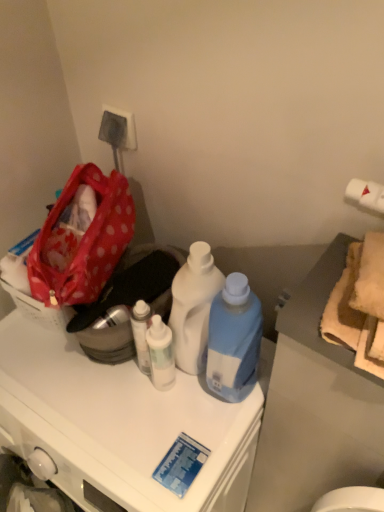
Question: From a real-world perspective, is red polka dot fabric bag at left located beneath white glossy bottle at center, acting as the 3th bottle starting from the right?

Choices:
 (A) no
 (B) yes

Answer: (A)

Question: Is red polka dot fabric bag at left at the left side of white glossy bottle at center, which ranks as the 1th bottle in left-to-right order?

Choices:
 (A) no
 (B) yes

Answer: (B)

Question: Could you tell me if red polka dot fabric bag at left is facing white glossy bottle at center, which ranks as the 1th bottle in left-to-right order?

Choices:
 (A) yes
 (B) no

Answer: (B)

Question: From the image's perspective, is red polka dot fabric bag at left below white glossy bottle at center, which ranks as the 1th bottle in left-to-right order?

Choices:
 (A) no
 (B) yes

Answer: (A)

Question: Is red polka dot fabric bag at left taller than white glossy bottle at center, acting as the 3th bottle starting from the right?

Choices:
 (A) yes
 (B) no

Answer: (A)

Question: Is red polka dot fabric bag at left not close to white glossy bottle at center, acting as the 3th bottle starting from the right?

Choices:
 (A) no
 (B) yes

Answer: (A)

Question: From a real-world perspective, is blue plastic bottle at center, the 1th bottle when ordered from right to left, over white glossy cabinet at center?

Choices:
 (A) yes
 (B) no

Answer: (A)

Question: From the image's perspective, is blue plastic bottle at center, which is counted as the third bottle, starting from the left, on white glossy cabinet at center?

Choices:
 (A) no
 (B) yes

Answer: (B)

Question: Is blue plastic bottle at center, the 1th bottle when ordered from right to left, thinner than white glossy cabinet at center?

Choices:
 (A) yes
 (B) no

Answer: (A)

Question: Is blue plastic bottle at center, which is counted as the third bottle, starting from the left, further to the viewer compared to white glossy cabinet at center?

Choices:
 (A) no
 (B) yes

Answer: (B)

Question: Can you confirm if blue plastic bottle at center, the 1th bottle when ordered from right to left, is positioned to the right of white glossy cabinet at center?

Choices:
 (A) yes
 (B) no

Answer: (A)

Question: Can you confirm if blue plastic bottle at center, the 1th bottle when ordered from right to left, is wider than white glossy cabinet at center?

Choices:
 (A) no
 (B) yes

Answer: (A)

Question: Is white plastic bottle at center, marked as the second bottle in a right-to-left arrangement, behind white glossy bottle at center, which ranks as the 1th bottle in left-to-right order?

Choices:
 (A) no
 (B) yes

Answer: (A)